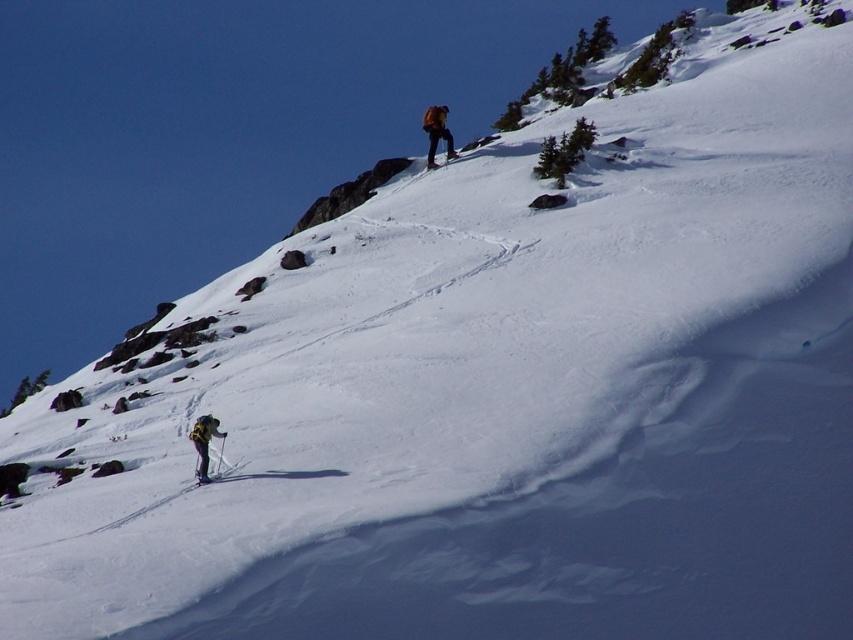
Describe the element at coordinates (436, 132) in the screenshot. I see `orange fabric jacket at upper center` at that location.

Does orange fabric jacket at upper center come behind black plastic ski pole at lower left?

Yes, it is behind black plastic ski pole at lower left.

Who is more distant from viewer, (432,134) or (219,445)?

Point (432,134)

Locate an element on the screen. The height and width of the screenshot is (640, 853). orange fabric jacket at upper center is located at coordinates (436, 132).

Does point (212, 417) come closer to viewer compared to point (223, 445)?

That is True.

The width and height of the screenshot is (853, 640). What do you see at coordinates (204, 442) in the screenshot?
I see `yellow fabric backpack at lower left` at bounding box center [204, 442].

This screenshot has height=640, width=853. What do you see at coordinates (204, 442) in the screenshot?
I see `yellow fabric backpack at lower left` at bounding box center [204, 442].

I want to click on yellow fabric backpack at lower left, so click(204, 442).

Is point (433, 157) farther from camera compared to point (202, 433)?

Yes, point (433, 157) is farther from viewer.

Between orange fabric jacket at upper center and yellow fabric backpack at lower left, which one appears on the right side from the viewer's perspective?

From the viewer's perspective, orange fabric jacket at upper center appears more on the right side.

This screenshot has height=640, width=853. Identify the location of orange fabric jacket at upper center. (436, 132).